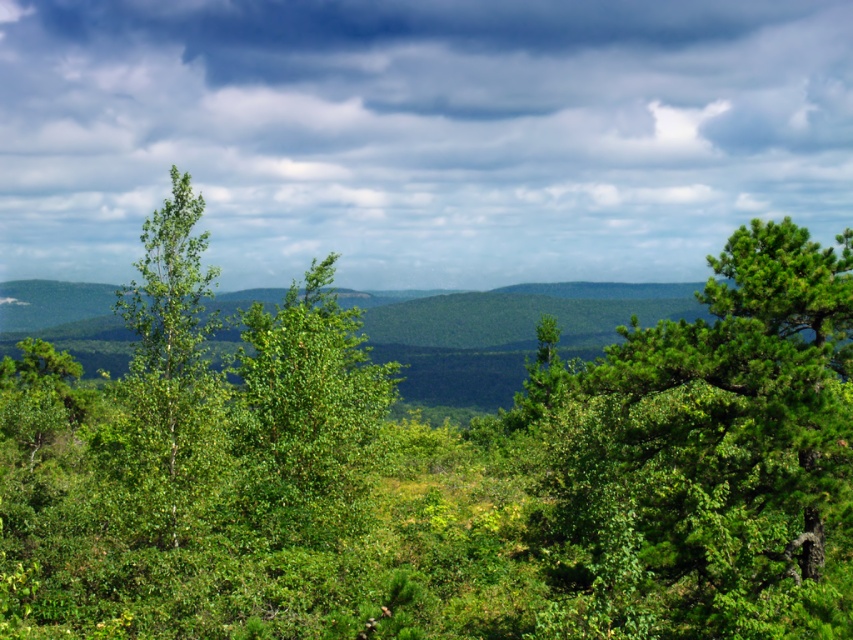
Question: Does green matte tree at right have a greater width compared to green matte tree at center?

Choices:
 (A) yes
 (B) no

Answer: (B)

Question: Among these objects, which one is nearest to the camera?

Choices:
 (A) green leafy tree at center
 (B) cloudy sky at upper center
 (C) green matte tree at center

Answer: (A)

Question: Which object appears farthest from the camera in this image?

Choices:
 (A) green leafy tree at center
 (B) green matte tree at right

Answer: (A)

Question: Which object is positioned farthest from the green leafy tree at center?

Choices:
 (A) green matte tree at right
 (B) green matte tree at center
 (C) cloudy sky at upper center

Answer: (C)

Question: Is green matte tree at right positioned before green matte tree at center?

Choices:
 (A) no
 (B) yes

Answer: (B)

Question: Can you confirm if green leafy tree at center is positioned to the left of green matte tree at center?

Choices:
 (A) yes
 (B) no

Answer: (B)